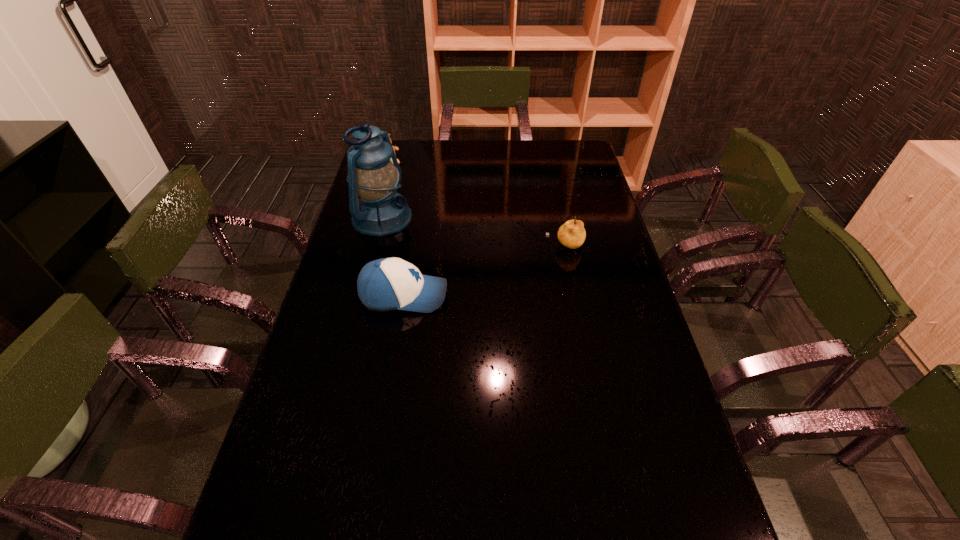
The image size is (960, 540). In order to click on vacant spot on the desktop that is between the baseball cap and the pear and is positioned on the face of the tallest object in this screenshot , I will do `click(509, 263)`.

Locate an element on the screen. This screenshot has height=540, width=960. vacant space on the desktop that is between the nearest object and the rightmost object and is positioned on the front-facing side of the farthest object is located at coordinates (470, 275).